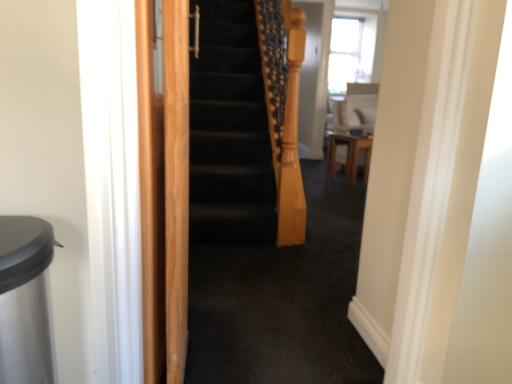
Describe the element at coordinates (164, 188) in the screenshot. The height and width of the screenshot is (384, 512). I see `light brown wood screen door at left` at that location.

What do you see at coordinates (348, 155) in the screenshot? Image resolution: width=512 pixels, height=384 pixels. I see `wooden table at center` at bounding box center [348, 155].

The width and height of the screenshot is (512, 384). I want to click on light brown wood screen door at left, so click(x=164, y=188).

Can you confirm if light brown wood screen door at left is taller than white glossy chair at upper right?

Yes.

Is point (185, 350) farther from camera compared to point (372, 96)?

No, (185, 350) is in front of (372, 96).

From a real-world perspective, is light brown wood screen door at left positioned under white glossy chair at upper right based on gravity?

Yes, from a real-world perspective, light brown wood screen door at left is under white glossy chair at upper right.

Who is smaller, wooden table at center or light brown wood screen door at left?

light brown wood screen door at left is smaller.

From a real-world perspective, is wooden table at center positioned over light brown wood screen door at left based on gravity?

No, from a real-world perspective, wooden table at center is not above light brown wood screen door at left.

Is wooden table at center beside light brown wood screen door at left?

No, wooden table at center is not beside light brown wood screen door at left.

Which of these two, wooden table at center or light brown wood screen door at left, is wider?

Wider between the two is wooden table at center.

Could you tell me if wooden table at center is turned towards white glossy chair at upper right?

No, wooden table at center is not aimed at white glossy chair at upper right.

Is the depth of wooden table at center less than that of white glossy chair at upper right?

Yes, wooden table at center is in front of white glossy chair at upper right.

Is wooden table at center to the right of white glossy chair at upper right from the viewer's perspective?

No.

Between white glossy chair at upper right and light brown wood screen door at left, which one has more height?

Standing taller between the two is light brown wood screen door at left.

From a real-world perspective, does white glossy chair at upper right stand above light brown wood screen door at left?

Yes, from a real-world perspective, white glossy chair at upper right is above light brown wood screen door at left.

Can you confirm if white glossy chair at upper right is smaller than light brown wood screen door at left?

Actually, white glossy chair at upper right might be larger than light brown wood screen door at left.

The width and height of the screenshot is (512, 384). I want to click on sit behind the light brown wood screen door at left, so click(x=355, y=113).

From the image's perspective, is white glossy chair at upper right beneath wooden table at center?

No, from the image's perspective, white glossy chair at upper right is not beneath wooden table at center.

Does point (364, 104) appear closer or farther from the camera than point (353, 141)?

Point (364, 104) is farther from the camera than point (353, 141).

At what (x,y) coordinates should I click in order to perform the action: click on furniture below the white glossy chair at upper right (from the image's perspective). Please return your answer as a coordinate pair (x, y). Looking at the image, I should click on pyautogui.click(x=348, y=155).

What's the angular difference between white glossy chair at upper right and wooden table at center's facing directions?

white glossy chair at upper right and wooden table at center are facing 125 degrees away from each other.

From the image's perspective, between light brown wood screen door at left and wooden table at center, which one is located above?

wooden table at center appears higher in the image.

Is wooden table at center inside light brown wood screen door at left?

No, wooden table at center is located outside of light brown wood screen door at left.

The image size is (512, 384). Find the location of `furniture that is on the right side of light brown wood screen door at left`. furniture that is on the right side of light brown wood screen door at left is located at coordinates (348, 155).

You are a GUI agent. You are given a task and a screenshot of the screen. Output one action in this format:
    pyautogui.click(x=<x>, y=<y>)
    Task: Click on the sit located on the right of light brown wood screen door at left
    
    Given the screenshot: What is the action you would take?
    pyautogui.click(x=355, y=113)

In the image, there is a light brown wood screen door at left. Identify the location of furniture below it (from a real-world perspective). (348, 155).

Looking at the image, which one is located further to light brown wood screen door at left, wooden table at center or white glossy chair at upper right?

white glossy chair at upper right.

Estimate the real-world distances between objects in this image. Which object is closer to wooden table at center, light brown wood screen door at left or white glossy chair at upper right?

white glossy chair at upper right lies closer to wooden table at center than the other object.

Considering their positions, is light brown wood screen door at left positioned further to white glossy chair at upper right than wooden table at center?

Answer: light brown wood screen door at left is positioned further to the anchor white glossy chair at upper right.

Estimate the real-world distances between objects in this image. Which object is further from light brown wood screen door at left, white glossy chair at upper right or wooden table at center?

white glossy chair at upper right.

When comparing their distances from white glossy chair at upper right, does wooden table at center or light brown wood screen door at left seem further?

light brown wood screen door at left is further to white glossy chair at upper right.

Which object lies further to the anchor point wooden table at center, white glossy chair at upper right or light brown wood screen door at left?

light brown wood screen door at left is further to wooden table at center.

The width and height of the screenshot is (512, 384). I want to click on furniture positioned between light brown wood screen door at left and white glossy chair at upper right from near to far, so click(348, 155).